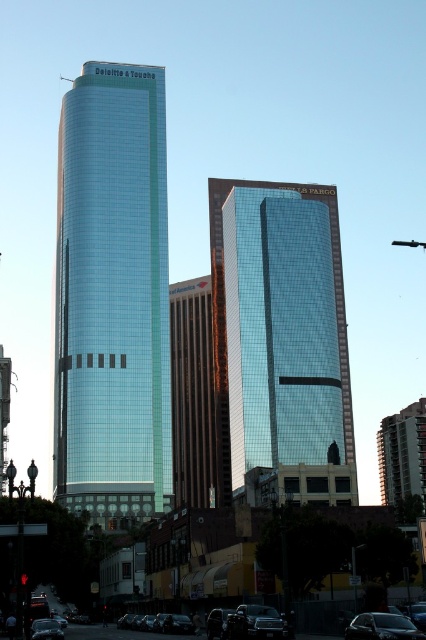
You are a drone operator trying to navigate between two skyscrapers in the city. The glassy blue skyscraper at left is your reference point. Can you determine if the other skyscraper is positioned to the right or left of it based on their coordinates?

The glassy blue skyscraper at left is located at point (x=112, y=294). Since the other skyscraper is positioned slightly behind and to the right, it is to the right of the glassy blue skyscraper at left.

You are a pedestrian standing at the crosswalk in the city scene. You see a shiny black car at center and a shiny black sedan at lower right. Which vehicle is closer to your left side?

The shiny black car at center is positioned on the left side of the shiny black sedan at lower right, so the shiny black car at center is closer to your left side.

You are a city planner evaluating the city layout. You notice the glassy reflective skyscraper at center and the shiny black sedan at lower right. Which object would cast a longer shadow during midday? Please explain your reasoning based on their positions and sizes.

The glassy reflective skyscraper at center would cast a longer shadow than the shiny black sedan at lower right because it is larger in size and positioned centrally, likely taller, making its shadow extend further during midday when the sun is high.